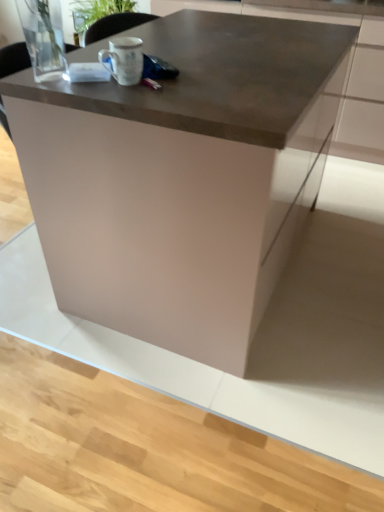
Question: Is satin metallic countertop at upper center bigger or smaller than matte brown table at center?

Choices:
 (A) big
 (B) small

Answer: (B)

Question: From the image's perspective, relative to matte brown table at center, is satin metallic countertop at upper center above or below?

Choices:
 (A) below
 (B) above

Answer: (B)

Question: Based on their relative distances, which object is nearer to the matte brown table at center?

Choices:
 (A) white matte mug at upper center
 (B) satin metallic countertop at upper center

Answer: (A)

Question: Based on their relative distances, which object is farther from the satin metallic countertop at upper center?

Choices:
 (A) matte brown table at center
 (B) white matte mug at upper center

Answer: (B)